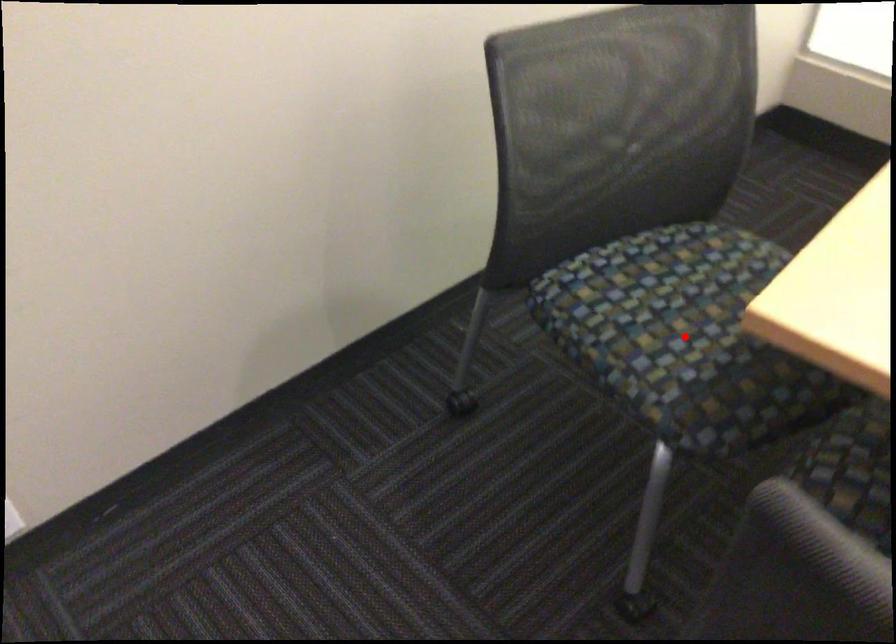
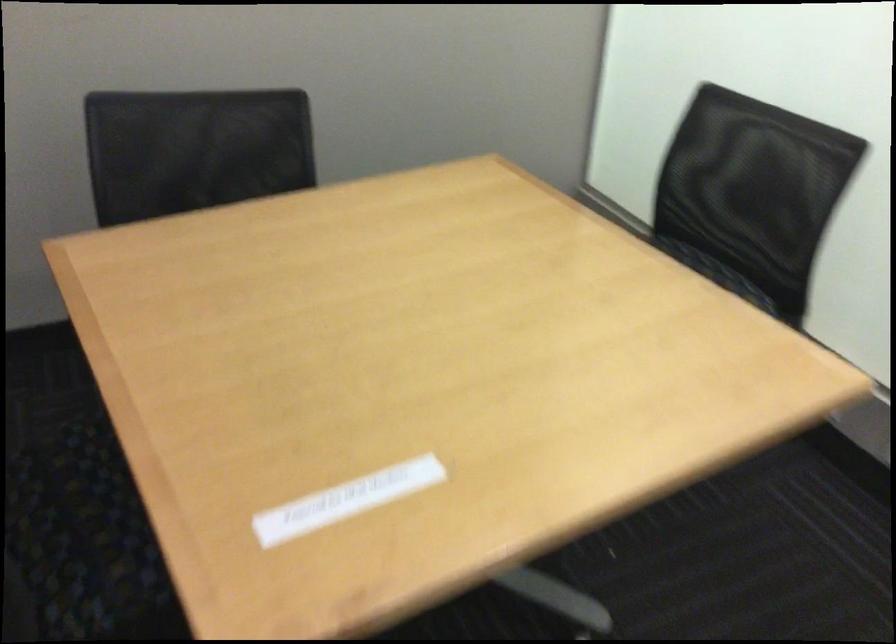
Question: I am providing you with two images of the same scene from different viewpoints. A red point is marked on the first image. At the location where the point appears in image 1, is it still visible in image 2?

Choices:
 (A) Yes
 (B) No

Answer: (B)